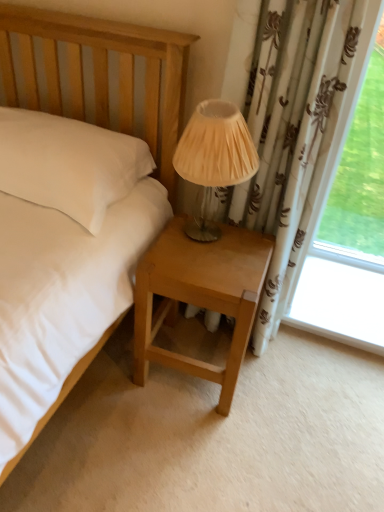
Question: Is light brown wood nightstand at lower center in front of or behind matte beige fabric lampshade at center in the image?

Choices:
 (A) front
 (B) behind

Answer: (B)

Question: Is light brown wood nightstand at lower center bigger or smaller than matte beige fabric lampshade at center?

Choices:
 (A) big
 (B) small

Answer: (A)

Question: From a real-world perspective, is light brown wood nightstand at lower center above or below matte beige fabric lampshade at center?

Choices:
 (A) above
 (B) below

Answer: (B)

Question: From the image's perspective, is matte beige fabric lampshade at center positioned above or below light brown wood nightstand at lower center?

Choices:
 (A) above
 (B) below

Answer: (A)

Question: From a real-world perspective, is matte beige fabric lampshade at center physically located above or below light brown wood nightstand at lower center?

Choices:
 (A) below
 (B) above

Answer: (B)

Question: In the image, is matte beige fabric lampshade at center on the left side or the right side of light brown wood nightstand at lower center?

Choices:
 (A) left
 (B) right

Answer: (B)

Question: Considering the positions of point (216, 119) and point (261, 278), is point (216, 119) closer or farther from the camera than point (261, 278)?

Choices:
 (A) farther
 (B) closer

Answer: (B)